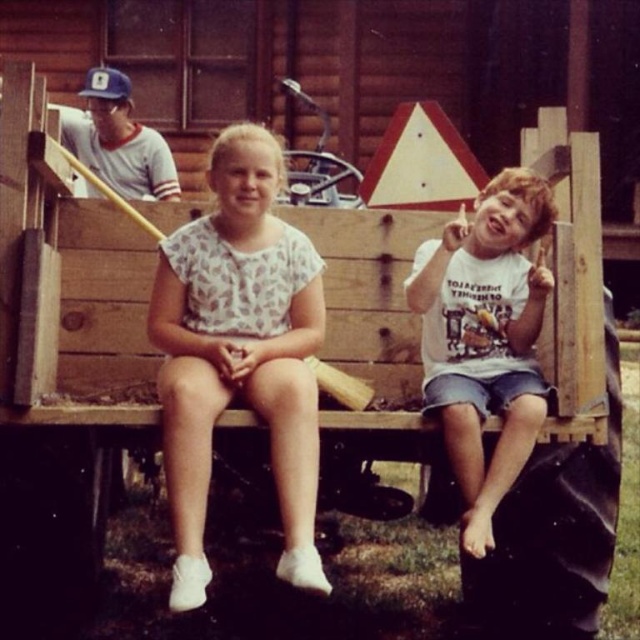
Does white floral dress at center appear on the right side of white cotton shirt at right?

In fact, white floral dress at center is to the left of white cotton shirt at right.

Can you confirm if white floral dress at center is smaller than white cotton shirt at right?

Actually, white floral dress at center might be larger than white cotton shirt at right.

At what (x,y) coordinates should I click in order to perform the action: click on white floral dress at center. Please return your answer as a coordinate pair (x, y). Looking at the image, I should click on (240, 353).

Find the location of a particular element. Image resolution: width=640 pixels, height=640 pixels. white floral dress at center is located at coordinates 240,353.